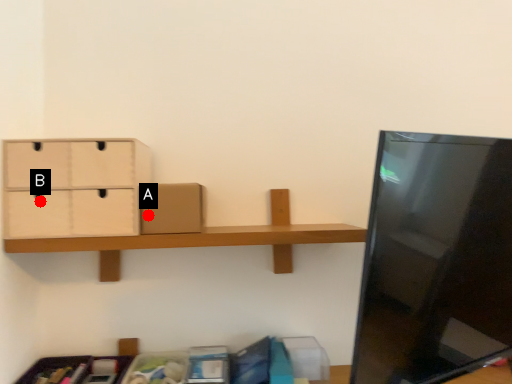
Question: Two points are circled on the image, labeled by A and B beside each circle. Which of the following is the farthest from the observer?

Choices:
 (A) A is further
 (B) B is further

Answer: (A)